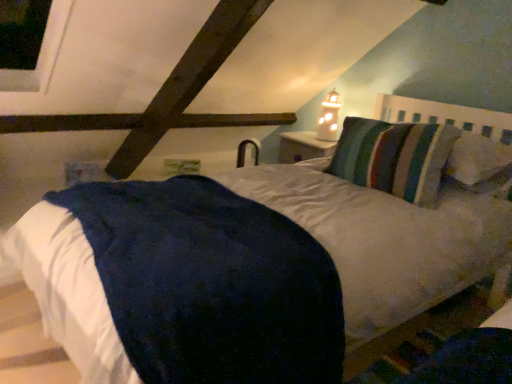
Question: From the image's perspective, is striped fabric pillow at upper right over white frosted glass at upper center?

Choices:
 (A) yes
 (B) no

Answer: (B)

Question: Is white frosted glass at upper center completely or partially inside striped fabric pillow at upper right?

Choices:
 (A) no
 (B) yes

Answer: (A)

Question: Is striped fabric pillow at upper right positioned before white frosted glass at upper center?

Choices:
 (A) no
 (B) yes

Answer: (B)

Question: From a real-world perspective, is striped fabric pillow at upper right physically above white frosted glass at upper center?

Choices:
 (A) no
 (B) yes

Answer: (A)

Question: Is striped fabric pillow at upper right smaller than white frosted glass at upper center?

Choices:
 (A) yes
 (B) no

Answer: (B)

Question: From their relative heights in the image, would you say dark blue plush mattress at center is taller or shorter than white frosted glass at upper center?

Choices:
 (A) short
 (B) tall

Answer: (A)

Question: From the image's perspective, is dark blue plush mattress at center above or below white frosted glass at upper center?

Choices:
 (A) above
 (B) below

Answer: (B)

Question: Considering the positions of dark blue plush mattress at center and white frosted glass at upper center in the image, is dark blue plush mattress at center bigger or smaller than white frosted glass at upper center?

Choices:
 (A) big
 (B) small

Answer: (A)

Question: Is dark blue plush mattress at center to the left or to the right of white frosted glass at upper center in the image?

Choices:
 (A) left
 (B) right

Answer: (A)

Question: Looking at their shapes, would you say dark blue plush mattress at center is wider or thinner than striped fabric pillow at upper right?

Choices:
 (A) thin
 (B) wide

Answer: (B)

Question: Is point (298, 294) closer or farther from the camera than point (381, 130)?

Choices:
 (A) closer
 (B) farther

Answer: (A)

Question: Is dark blue plush mattress at center taller or shorter than striped fabric pillow at upper right?

Choices:
 (A) short
 (B) tall

Answer: (A)

Question: Considering the relative positions of dark blue plush mattress at center and striped fabric pillow at upper right in the image provided, is dark blue plush mattress at center to the left or to the right of striped fabric pillow at upper right?

Choices:
 (A) left
 (B) right

Answer: (A)

Question: Based on their positions, is striped fabric pillow at upper right located to the left or right of white frosted glass at upper center?

Choices:
 (A) left
 (B) right

Answer: (B)

Question: Considering the positions of striped fabric pillow at upper right and white frosted glass at upper center in the image, is striped fabric pillow at upper right wider or thinner than white frosted glass at upper center?

Choices:
 (A) thin
 (B) wide

Answer: (B)